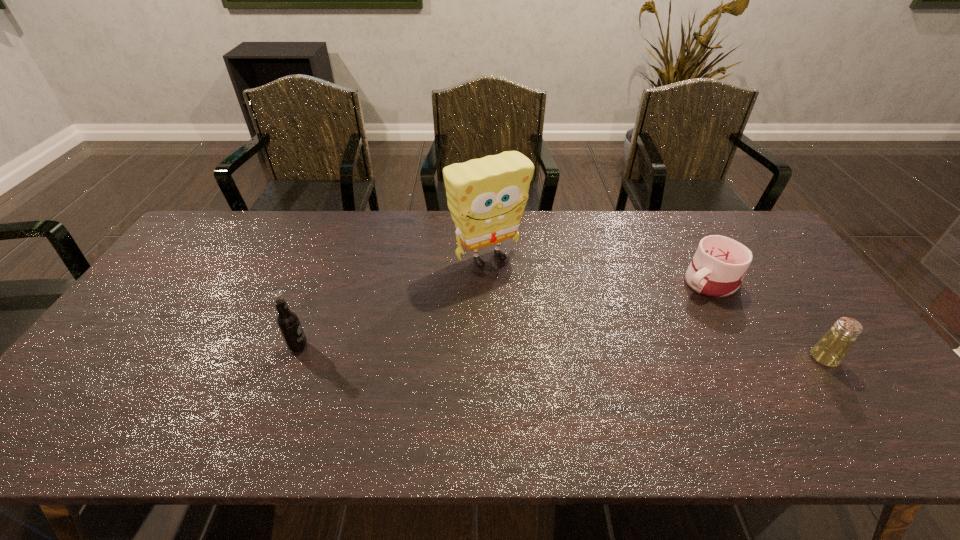
In order to click on vacant space located on the face of the tallest object in this screenshot , I will do `click(551, 329)`.

The width and height of the screenshot is (960, 540). Find the location of `free space located on the side with the handle of the mug`. free space located on the side with the handle of the mug is located at coordinates (659, 304).

The height and width of the screenshot is (540, 960). What are the coordinates of `vacant space located 0.230m on the side with the handle of the mug` in the screenshot? It's located at (630, 318).

Where is `vacant space located 0.230m on the side with the handle of the mug`? vacant space located 0.230m on the side with the handle of the mug is located at coordinates (630, 318).

Identify the location of object present at the far edge. Image resolution: width=960 pixels, height=540 pixels. (486, 197).

The height and width of the screenshot is (540, 960). I want to click on object that is at the right edge, so click(x=830, y=350).

The width and height of the screenshot is (960, 540). Identify the location of vacant space at the far edge of the desktop. (635, 226).

Find the location of a particular element. The image size is (960, 540). free space at the near edge of the desktop is located at coordinates 715,404.

Locate an element on the screen. vacant region at the right edge of the desktop is located at coordinates (799, 353).

Find the location of a particular element. This screenshot has height=540, width=960. free region at the near left corner is located at coordinates (100, 405).